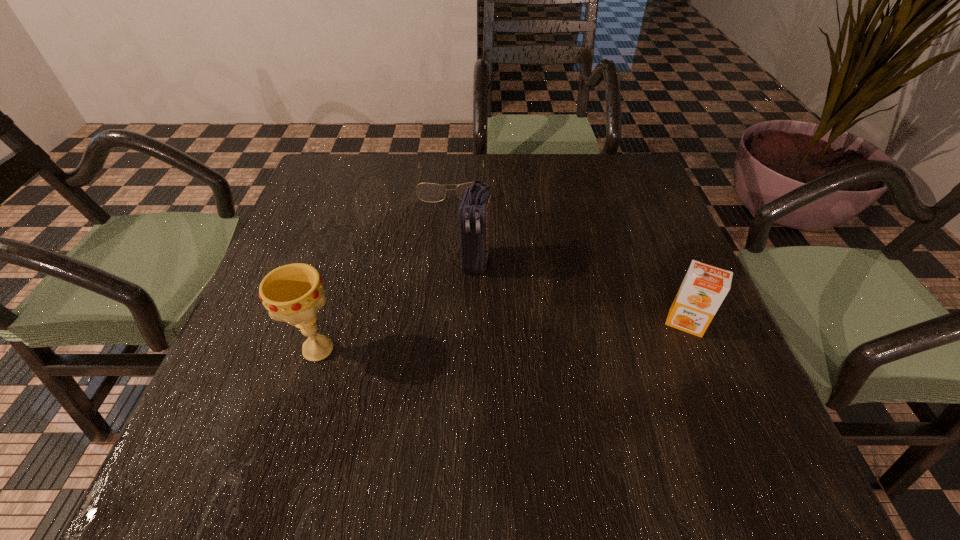
You are a GUI agent. You are given a task and a screenshot of the screen. Output one action in this format:
    pyautogui.click(x=<x>, y=<y>)
    Task: Click on the vacant area that lies between the farthest object and the leftmost object
    
    Given the screenshot: What is the action you would take?
    pyautogui.click(x=385, y=267)

The width and height of the screenshot is (960, 540). What are the coordinates of `free space between the orange juice and the farthest object` in the screenshot? It's located at (568, 253).

The image size is (960, 540). Identify the location of unoccupied position between the leftmost object and the shortest object. [x=385, y=267].

Locate an element on the screen. free space between the chalice and the orange juice is located at coordinates (502, 336).

Identify the location of object that can be found as the closest to the farthest object. click(x=474, y=213).

Locate which object ranks third in proximity to the farthest object. Please provide its 2D coordinates. Your answer should be formatted as a tuple, i.e. [(x, y)], where the tuple contains the x and y coordinates of a point satisfying the conditions above.

[(704, 287)]

At what (x,y) coordinates should I click in order to perform the action: click on vacant space that satisfies the following two spatial constraints: 1. on the back side of the orange juice; 2. on the left side of the chalice. Please return your answer as a coordinate pair (x, y). This screenshot has height=540, width=960. Looking at the image, I should click on (326, 323).

Image resolution: width=960 pixels, height=540 pixels. I want to click on vacant space that satisfies the following two spatial constraints: 1. on the back side of the shortest object; 2. on the right side of the chalice, so click(x=369, y=184).

Locate an element on the screen. free location that satisfies the following two spatial constraints: 1. on the front side of the shortest object; 2. on the left side of the orange juice is located at coordinates click(441, 323).